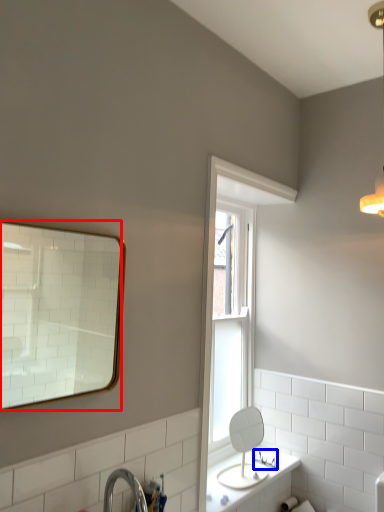
Question: Which object is closer to the camera taking this photo, mirror (highlighted by a red box) or plumbing fixture (highlighted by a blue box)?

Choices:
 (A) mirror
 (B) plumbing fixture

Answer: (A)